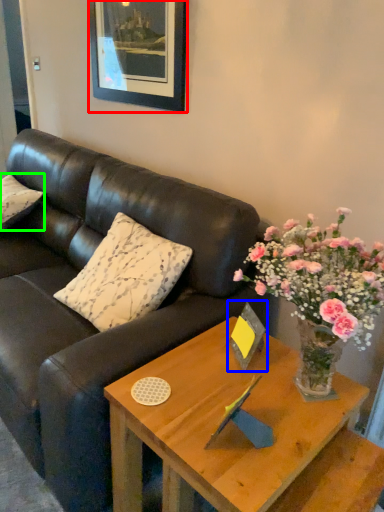
Question: Considering the real-world distances, which object is closest to picture frame (highlighted by a red box)? picture frame (highlighted by a blue box) or pillow (highlighted by a green box).

Choices:
 (A) picture frame
 (B) pillow

Answer: (B)